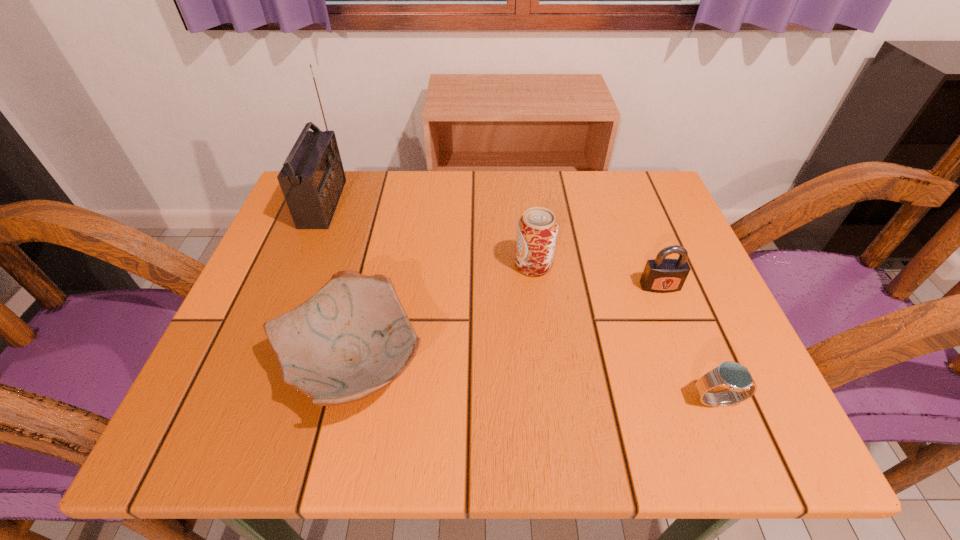
The height and width of the screenshot is (540, 960). I want to click on vacant region located on the right of the pottery, so click(639, 363).

The height and width of the screenshot is (540, 960). In order to click on free space located 0.260m on the left of the watch in this screenshot , I will do `click(527, 400)`.

Where is `object that is positioned at the far edge`? The image size is (960, 540). object that is positioned at the far edge is located at coordinates (312, 178).

Where is `pottery that is at the near edge`? This screenshot has height=540, width=960. pottery that is at the near edge is located at coordinates (352, 338).

Find the location of a particular element. Image resolution: width=960 pixels, height=540 pixels. watch that is at the near edge is located at coordinates (737, 378).

Where is `radio receiver situated at the left edge`? This screenshot has height=540, width=960. radio receiver situated at the left edge is located at coordinates (312, 178).

In order to click on pottery present at the left edge in this screenshot , I will do `click(352, 338)`.

Find the location of a particular element. The width and height of the screenshot is (960, 540). padlock that is at the right edge is located at coordinates tap(661, 275).

Locate an element on the screen. watch that is at the right edge is located at coordinates (737, 378).

Locate an element on the screen. Image resolution: width=960 pixels, height=540 pixels. object situated at the far left corner is located at coordinates (312, 178).